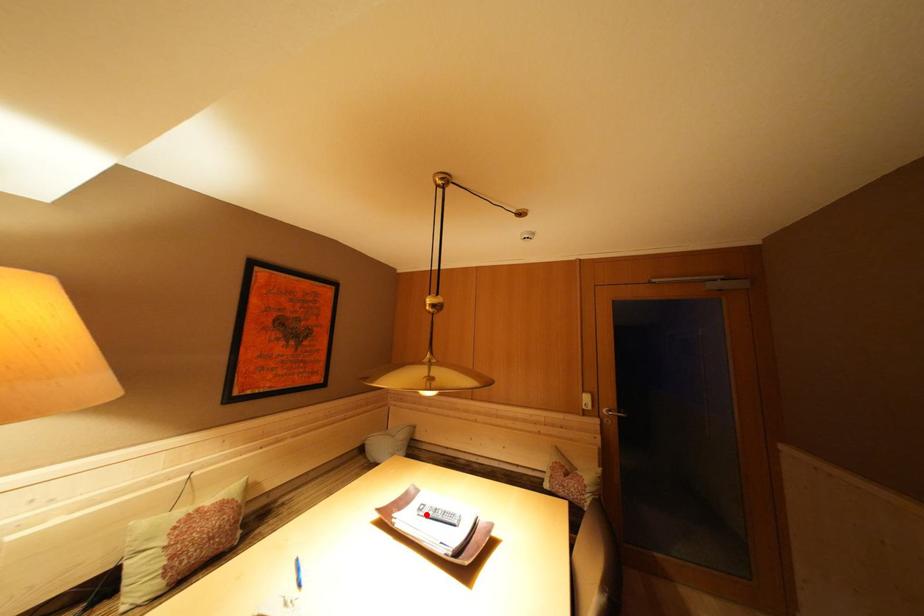
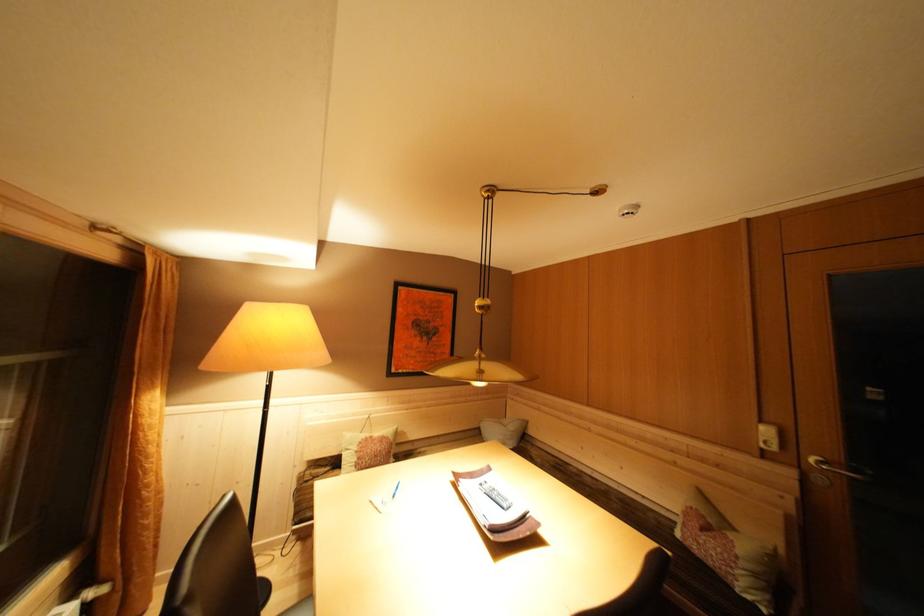
Find the pixel in the second image that matches the highlighted location in the first image.

(488, 488)